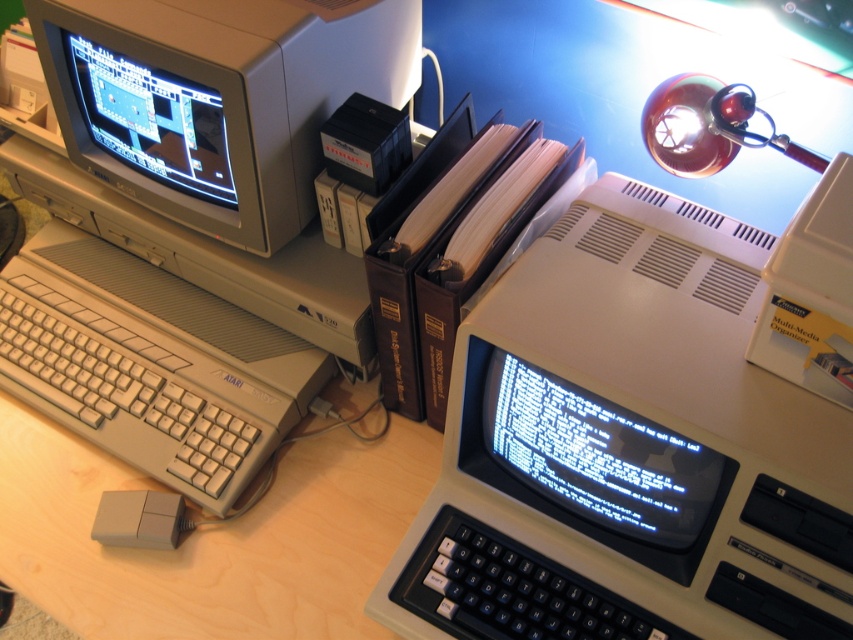
You are setting up a display for a tech exhibition and need to arrange two monitors on a shelf. The shelf has limited depth. You have the matte gray monitor at upper left and the shiny plastic monitor at upper left. Which monitor should you place closer to the front of the shelf to match the arrangement in the image?

The matte gray monitor at upper left should be placed closer to the front of the shelf because in the image, the matte gray monitor at upper left is in front of the shiny plastic monitor at upper left.

You are setting up a new cable between the beige plastic keyboard at left and the blue glossy monitor at center. According to the setup, where should the cable be connected from the keyboard to the monitor?

The beige plastic keyboard at left is located above the blue glossy monitor at center, so the cable should be connected from the beige plastic keyboard at left downward to the blue glossy monitor at center.

You are setting up a new shelf to display your vintage computers. The beige plastic computer at center and the shiny plastic monitor at upper left need to be placed on the shelf. If the shelf has limited height space, which object should you place first to ensure it fits?

The beige plastic computer at center is much taller than the shiny plastic monitor at upper left, so you should place the beige plastic computer at center first to ensure it fits within the shelf height limits.